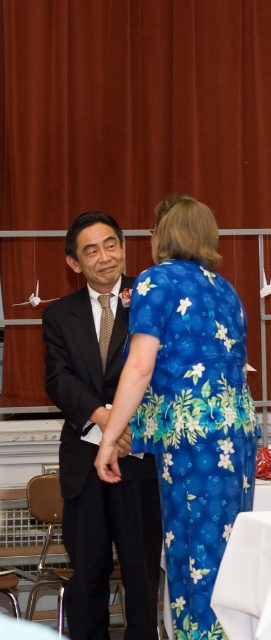
You are standing in the formal indoor setting where two people are shaking hands. You need to determine which of the two points, point (214,32) or point (94,244), is closer to you. Which point is closer?

Point (214,32) is further to the viewer than point (94,244), so the closer point to you is point (94,244).

In the scene where a man in a dark suit and a woman in a blue floral outfit are near a red curtain, there is a point labeled as point (140, 122). What object does this point correspond to?

The point (140, 122) corresponds to the matte red curtain at upper center.

In the scene shown: You are a photographer setting up for an event. You need to position a 1.2 meter wide backdrop behind the matte black suit at center. Given the white fabric tablecloth at lower center is currently in the way, will the backdrop fit if you move it to where the tablecloth is now?

The matte black suit at center is wider than the white fabric tablecloth at lower center. Since the backdrop is 1.2 meters wide, moving it to the tablecloth area may not be sufficient as the tablecloth area is narrower than the suit. Check the space requirements again.